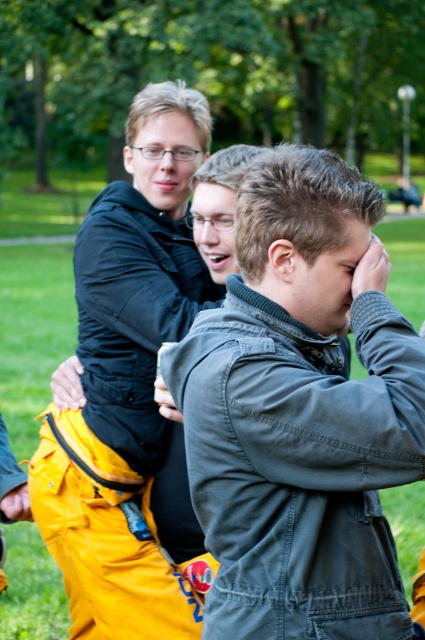
You are standing in the park and see two jackets. The dark gray fabric jacket at center and the matte black jacket at left. Which jacket is nearer to you?

The dark gray fabric jacket at center is closer to the viewer than the matte black jacket at left.

You are standing in the park and see two points marked in the image. Which point is closer to you, point (326, 360) or point (116, 412)?

Point (326, 360) is closer to the viewer than point (116, 412).